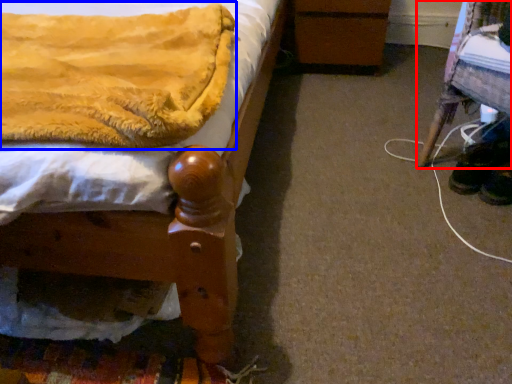
Question: Which of the following is the closest to the observer, furniture (highlighted by a red box) or blanket (highlighted by a blue box)?

Choices:
 (A) furniture
 (B) blanket

Answer: (B)